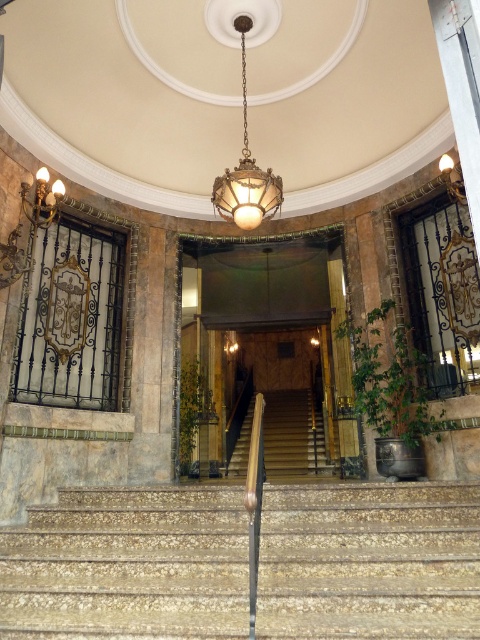
Can you confirm if wooden paneling at center is wider than wooden staircase at center?

Yes.

Who is lower down, wooden paneling at center or wooden staircase at center?

Positioned lower is wooden staircase at center.

Locate an element on the screen. This screenshot has width=480, height=640. wooden paneling at center is located at coordinates (271, 353).

Is wooden paneling at center to the right of matte brass chandelier at center from the viewer's perspective?

Indeed, wooden paneling at center is positioned on the right side of matte brass chandelier at center.

Between wooden paneling at center and matte brass chandelier at center, which one is positioned higher?

matte brass chandelier at center is above.

Who is more distant from viewer, (272, 456) or (249, 24)?

Point (272, 456)

Identify the location of wooden paneling at center. (271, 353).

Who is more distant from viewer, (242, 172) or (443, 156)?

Point (443, 156)

Can you confirm if matte brass chandelier at center is wider than metallic brass lamp at upper right?

Yes, matte brass chandelier at center is wider than metallic brass lamp at upper right.

Is point (248, 212) positioned before point (446, 186)?

Yes, it is in front of point (446, 186).

Where is `matte brass chandelier at center`? matte brass chandelier at center is located at coordinates (247, 170).